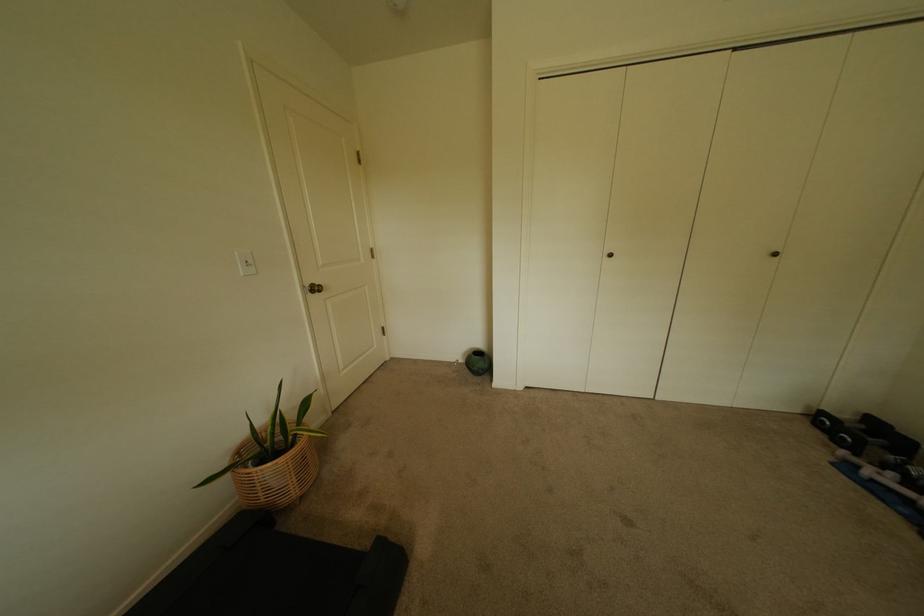
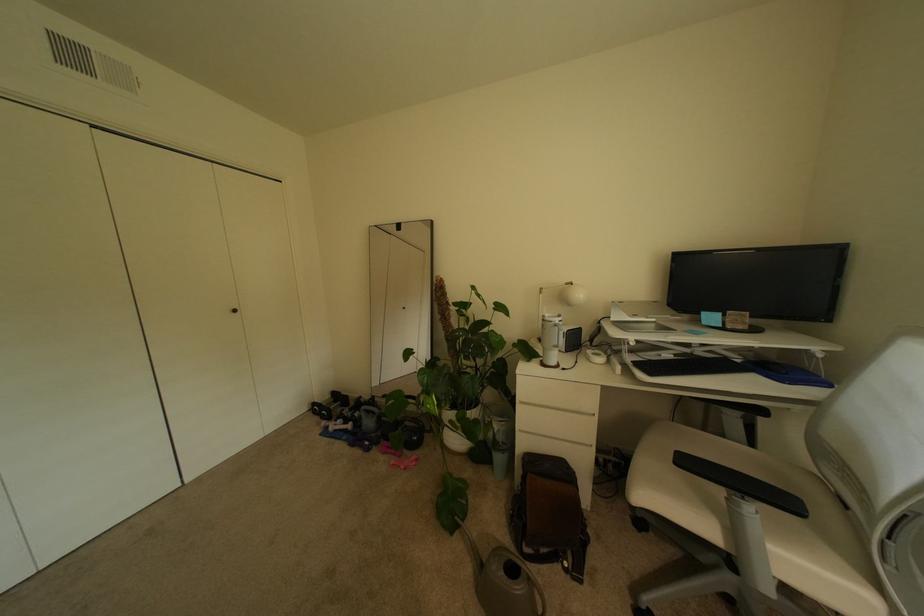
Question: The camera is either moving clockwise (left) or counter-clockwise (right) around the object. The first image is from the beginning of the video and the second image is from the end. Is the camera moving left or right when shooting the video?

Choices:
 (A) Left
 (B) Right

Answer: (A)